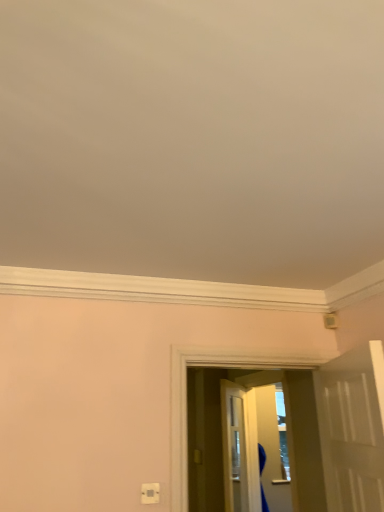
Question: Looking at the image, does white plastic electric outlet at lower center seem bigger or smaller compared to transparent plastic screen door at center?

Choices:
 (A) big
 (B) small

Answer: (B)

Question: In the image, is white plastic electric outlet at lower center positioned in front of or behind transparent plastic screen door at center?

Choices:
 (A) front
 (B) behind

Answer: (A)

Question: Which object is positioned closest to the white glossy door at right?

Choices:
 (A) white plastic electric outlet at lower center
 (B) transparent plastic screen door at center

Answer: (A)

Question: Which object is positioned closest to the transparent plastic screen door at center?

Choices:
 (A) white glossy door at right
 (B) white plastic electric outlet at lower center

Answer: (A)